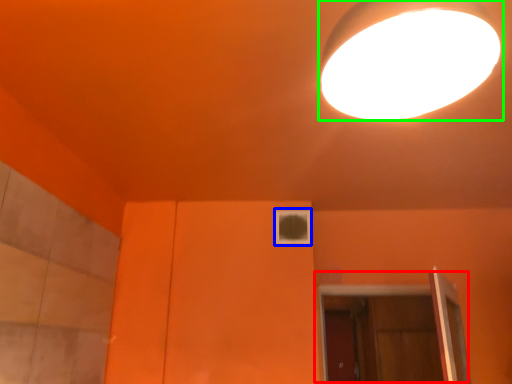
Question: Which object is the closest to the door (highlighted by a red box)? Choose among these: window (highlighted by a blue box) or lamp (highlighted by a green box).

Choices:
 (A) window
 (B) lamp

Answer: (A)